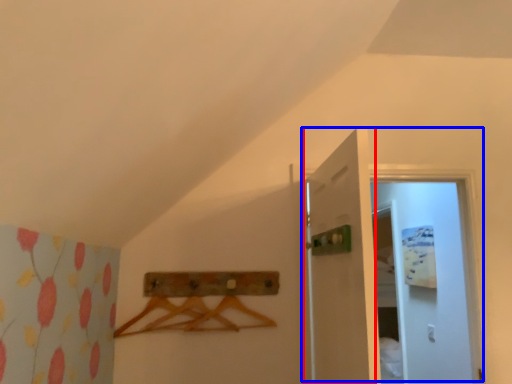
Question: Which point is closer to the camera, door (highlighted by a red box) or door (highlighted by a blue box)?

Choices:
 (A) door
 (B) door

Answer: (A)